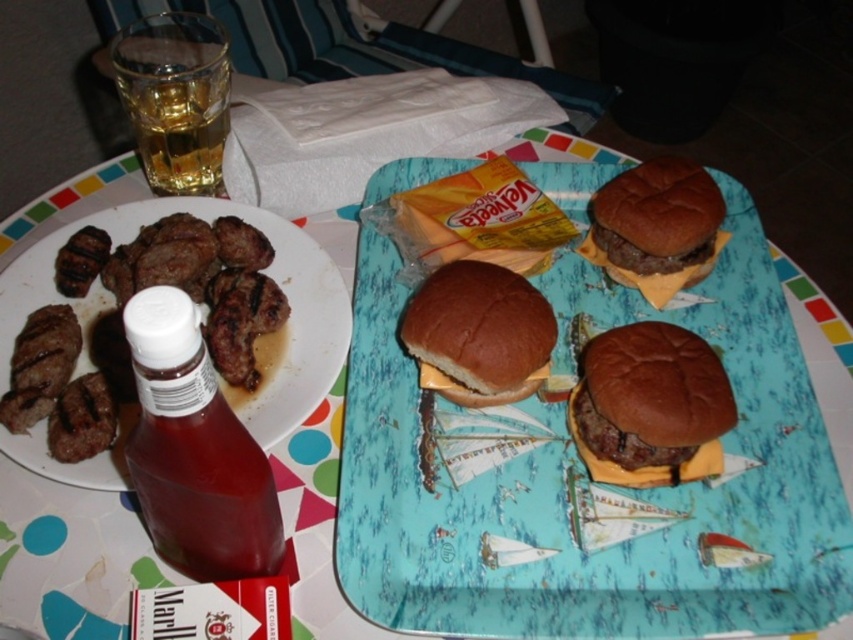
You are a food delivery person who needs to place a hot pad between the brown charred meat at left and the brown matte burger at center to prevent burns. The hot pad is 25 centimeters wide. Will it fit between them?

The distance between the brown charred meat at left and the brown matte burger at center is 26.46 centimeters. Since the hot pad is 25 centimeters wide, it will fit with 1.46 centimeters of space remaining between them.